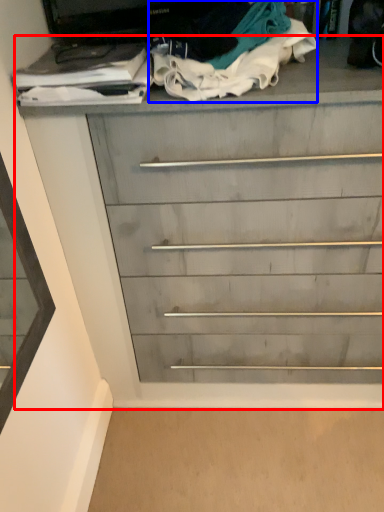
Question: Which object is further to the camera taking this photo, chest of drawers (highlighted by a red box) or clothing (highlighted by a blue box)?

Choices:
 (A) chest of drawers
 (B) clothing

Answer: (A)